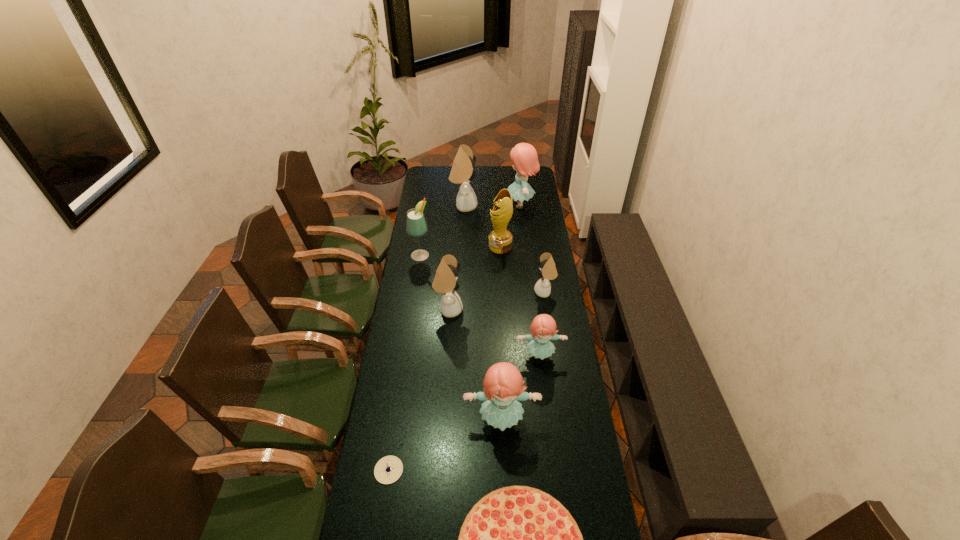
Where is `free space at the left edge`? The image size is (960, 540). free space at the left edge is located at coordinates (386, 361).

I want to click on vacant space at the right edge of the desktop, so click(x=571, y=414).

This screenshot has width=960, height=540. I want to click on free region at the far left corner of the desktop, so click(x=430, y=171).

Where is `free area in between the second biggest black doll and the fourth nearest object`? The height and width of the screenshot is (540, 960). free area in between the second biggest black doll and the fourth nearest object is located at coordinates (494, 333).

The width and height of the screenshot is (960, 540). What are the coordinates of `vacant space that's between the second smallest blue doll and the second shortest object` in the screenshot? It's located at (445, 446).

Locate an element on the screen. The height and width of the screenshot is (540, 960). free area in between the third nearest object and the biggest blue doll is located at coordinates (511, 313).

Where is `vacant space that is in between the award and the second smallest blue doll`? The height and width of the screenshot is (540, 960). vacant space that is in between the award and the second smallest blue doll is located at coordinates (501, 334).

Where is `vacant area that lies between the farthest black doll and the blue compass`? vacant area that lies between the farthest black doll and the blue compass is located at coordinates (426, 338).

Find the location of a particular element. The width and height of the screenshot is (960, 540). free spot between the farthest blue doll and the second shortest object is located at coordinates (454, 338).

Identify the location of unoccupied area between the award and the second nearest doll. (520, 301).